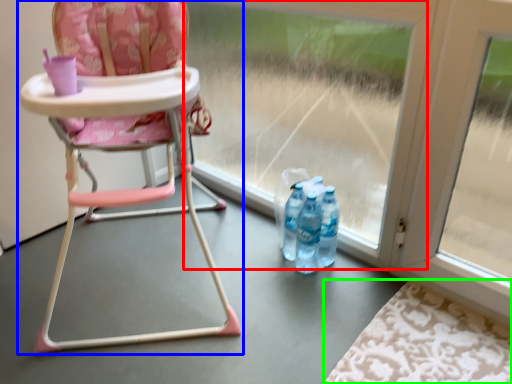
Question: Estimate the real-world distances between objects in this image. Which object is farther from glass door (highlighted by a red box), chair (highlighted by a blue box) or mat (highlighted by a green box)?

Choices:
 (A) chair
 (B) mat

Answer: (B)